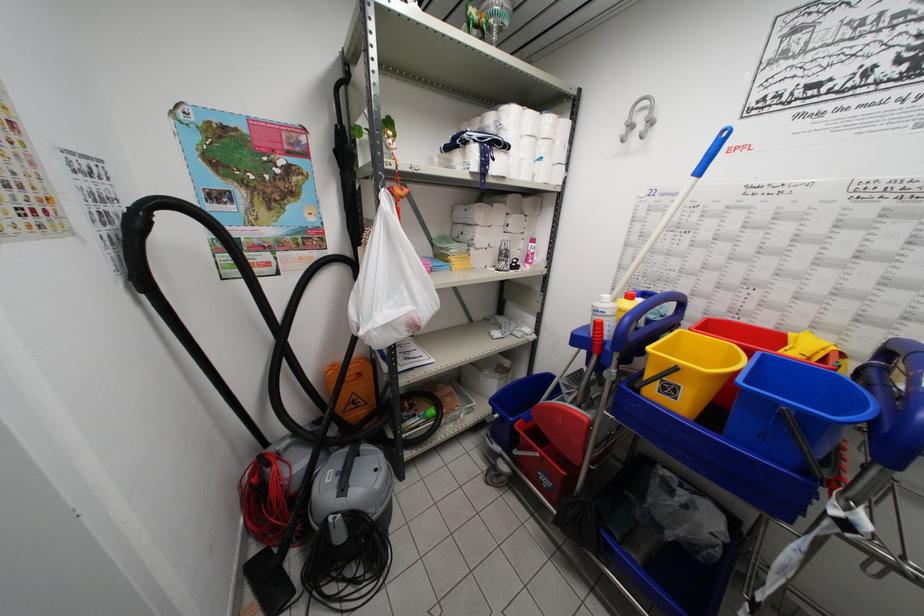
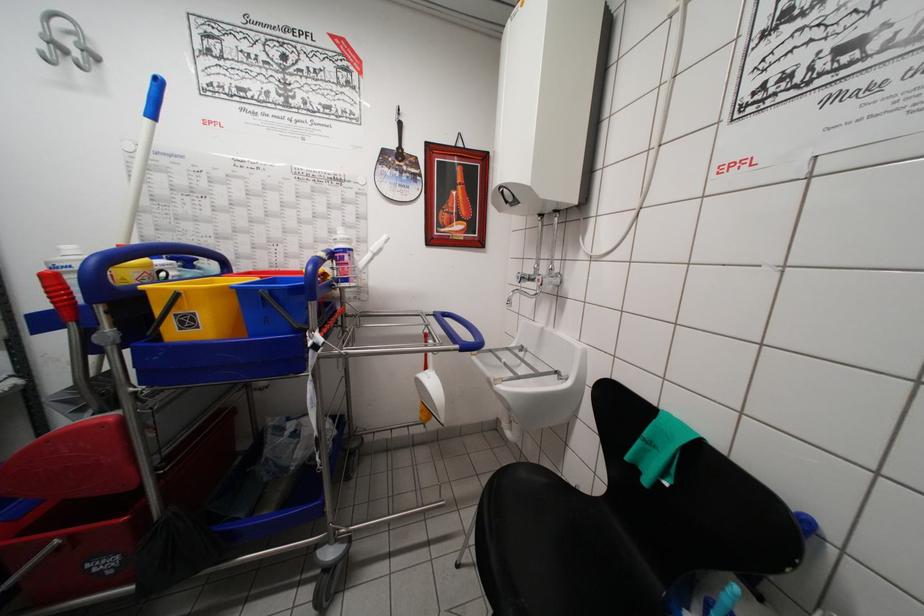
Question: The camera is either moving clockwise (left) or counter-clockwise (right) around the object. The first image is from the beginning of the video and the second image is from the end. Is the camera moving left or right when shooting the video?

Choices:
 (A) Left
 (B) Right

Answer: (A)